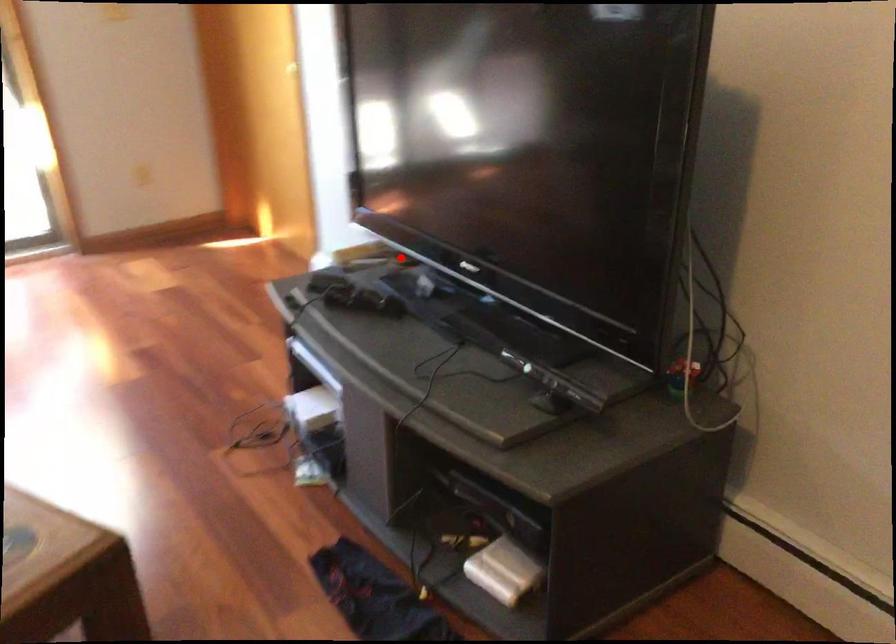
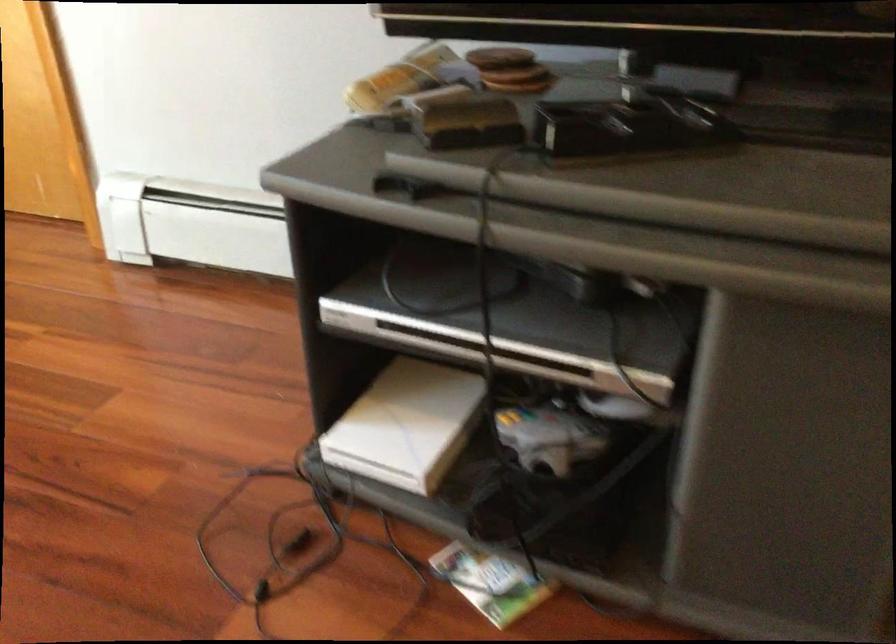
Find the pixel in the second image that matches the highlighted location in the first image.

(519, 80)